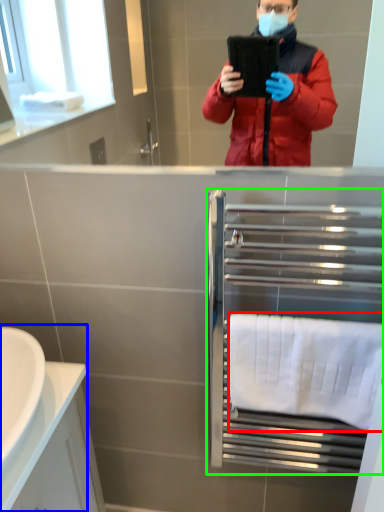
Question: Based on their relative distances, which object is farther from towel/napkin (highlighted by a red box)? Choose from sink (highlighted by a blue box) and balustrade (highlighted by a green box).

Choices:
 (A) sink
 (B) balustrade

Answer: (A)